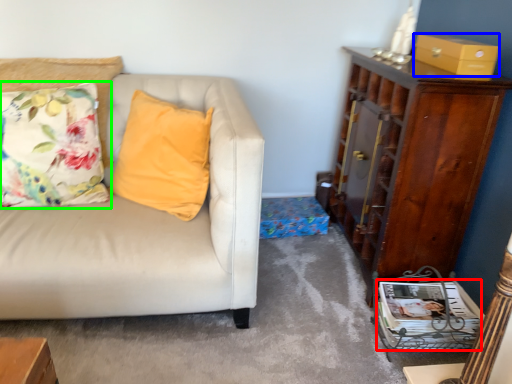
Question: Which object is positioned farthest from magazine (highlighted by a red box)? Select from box (highlighted by a blue box) and pillow (highlighted by a green box).

Choices:
 (A) box
 (B) pillow

Answer: (B)